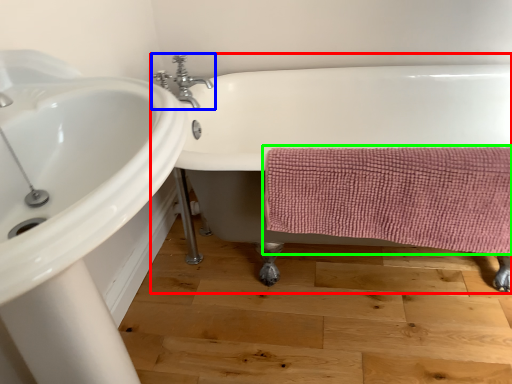
Question: Based on their relative distances, which object is farther from bathtub (highlighted by a red box)? Choose from tap (highlighted by a blue box) and bath towel (highlighted by a green box).

Choices:
 (A) tap
 (B) bath towel

Answer: (A)